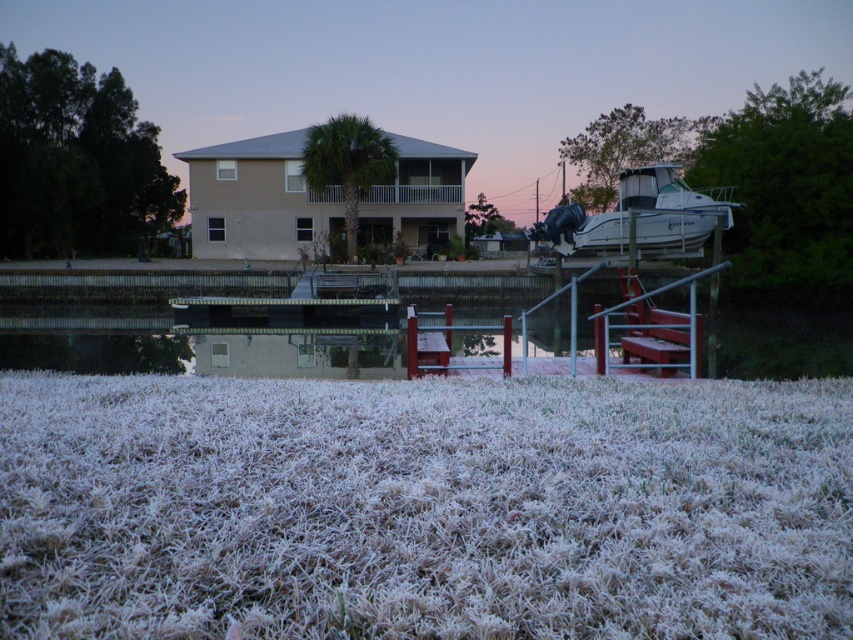
You are standing at the edge of the frosted grass at lower center. Which direction should you walk to reach the dock?

Walk towards the right side of the frame from the frosted grass at lower center to reach the dock.

You are standing at the edge of the frosted grass at lower center and want to reach the white glossy boat at right. Which direction should you move to get there?

You should move to the right because the frosted grass at lower center is to the left of the white glossy boat at right.

You are a photographer wanting to capture both the frosted grass at lower center and the white glossy boat at right in the same frame. Which object should you focus on first if you want the larger one to be in sharp focus?

The white glossy boat at right is larger than the frosted grass at lower center, so you should focus on the white glossy boat at right first to ensure it is in sharp focus.